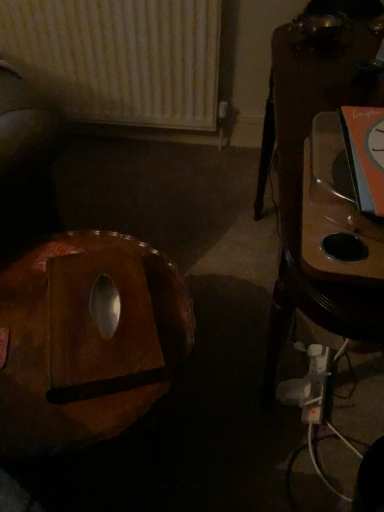
Question: In terms of height, does wooden table at right look taller or shorter compared to brown leather bean bag chair at lower left?

Choices:
 (A) tall
 (B) short

Answer: (A)

Question: Based on their positions, is wooden table at right located to the left or right of brown leather bean bag chair at lower left?

Choices:
 (A) left
 (B) right

Answer: (B)

Question: Which object is positioned closest to the brown leather bean bag chair at lower left?

Choices:
 (A) white textured radiator at upper left
 (B) wooden table at right

Answer: (B)

Question: Which object is the farthest from the white textured radiator at upper left?

Choices:
 (A) brown leather bean bag chair at lower left
 (B) wooden table at right

Answer: (A)